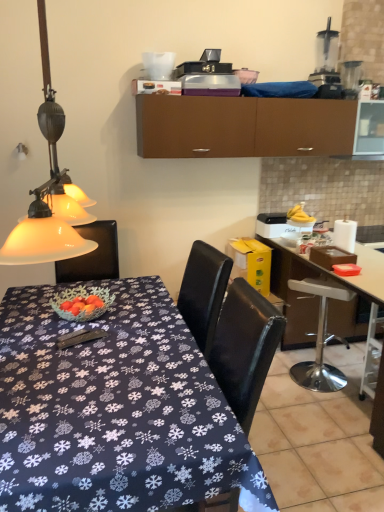
Identify the location of vacant space situated above dark blue fabric table at center, which appears as the first desk when viewed from the left (from a real-world perspective). (98, 343).